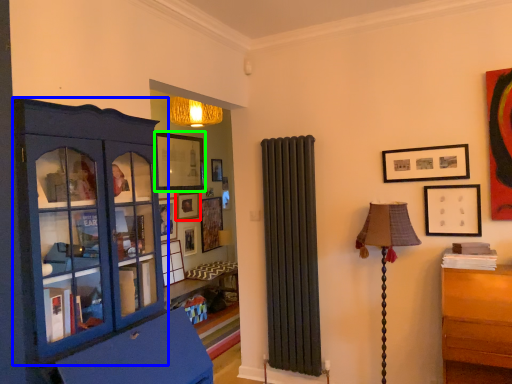
Question: Estimate the real-world distances between objects in this image. Which object is farther from picture frame (highlighted by a red box), cabinetry (highlighted by a blue box) or picture frame (highlighted by a green box)?

Choices:
 (A) cabinetry
 (B) picture frame

Answer: (A)